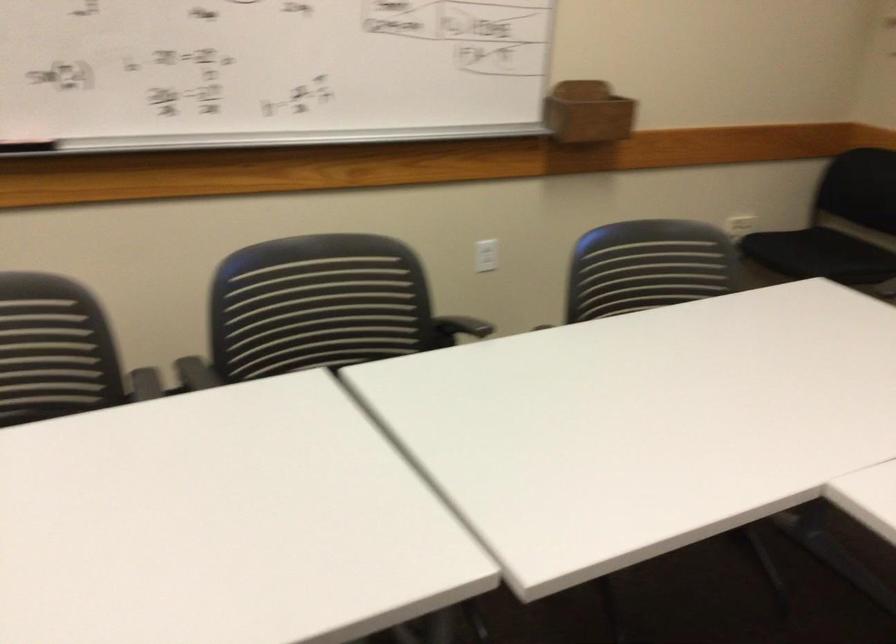
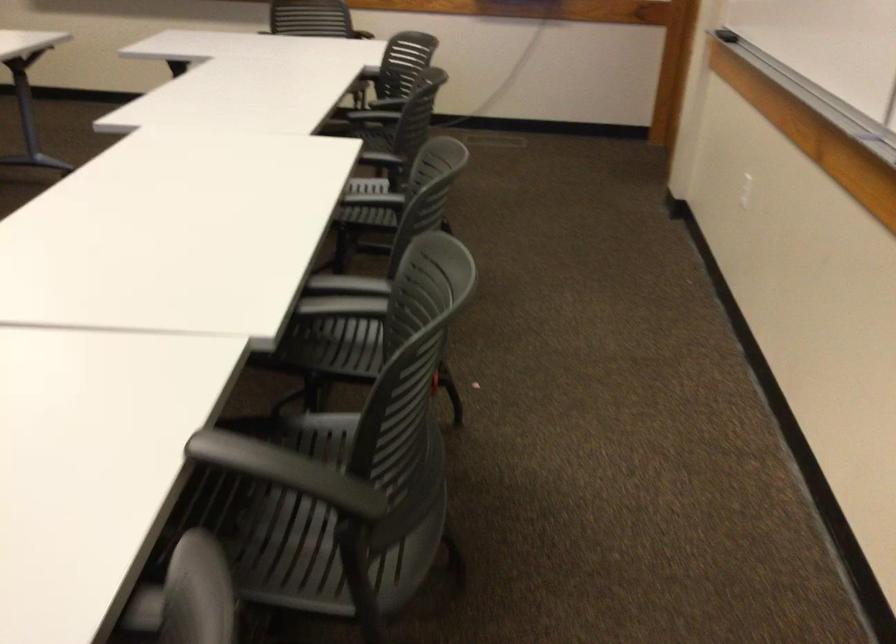
Find the pixel in the second image that matches (459,321) in the first image.

(286, 471)